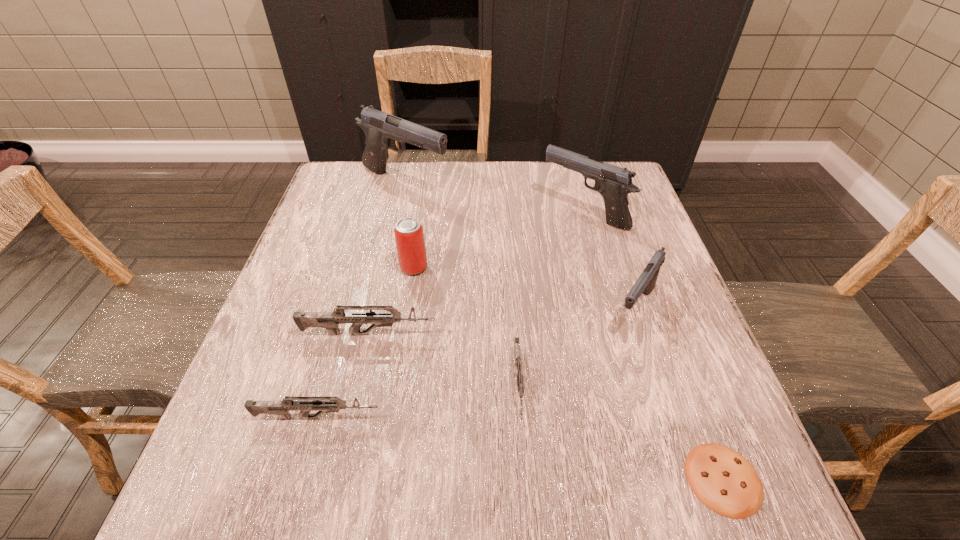
In order to click on vacant space that's between the pink beer can and the smallest black gun in this screenshot , I will do `click(524, 288)`.

I want to click on free space that is in between the shortest object and the third shortest gun, so click(x=546, y=407).

Find the location of a particular element. free point between the biggest grey gun and the fifth tallest gun is located at coordinates click(343, 376).

Locate an element on the screen. The width and height of the screenshot is (960, 540). empty space that is in between the fourth shortest gun and the second tallest gun is located at coordinates (610, 260).

At what (x,y) coordinates should I click in order to perform the action: click on empty location between the tallest gun and the fourth shortest object. Please return your answer as a coordinate pair (x, y). This screenshot has width=960, height=540. Looking at the image, I should click on (387, 259).

Identify the location of free space between the second shortest gun and the seventh shortest object. The width and height of the screenshot is (960, 540). (451, 315).

At what (x,y) coordinates should I click in order to perform the action: click on free space between the beer can and the third tallest gun. Please return your answer as a coordinate pair (x, y). Looking at the image, I should click on (524, 288).

This screenshot has height=540, width=960. What are the coordinates of `empty location between the nearest object and the tallest object` in the screenshot? It's located at (564, 331).

The width and height of the screenshot is (960, 540). Find the location of `object that ranks as the closest to the farthest grey gun`. object that ranks as the closest to the farthest grey gun is located at coordinates (409, 236).

The height and width of the screenshot is (540, 960). I want to click on object identified as the fifth closest to the farthest grey gun, so click(614, 183).